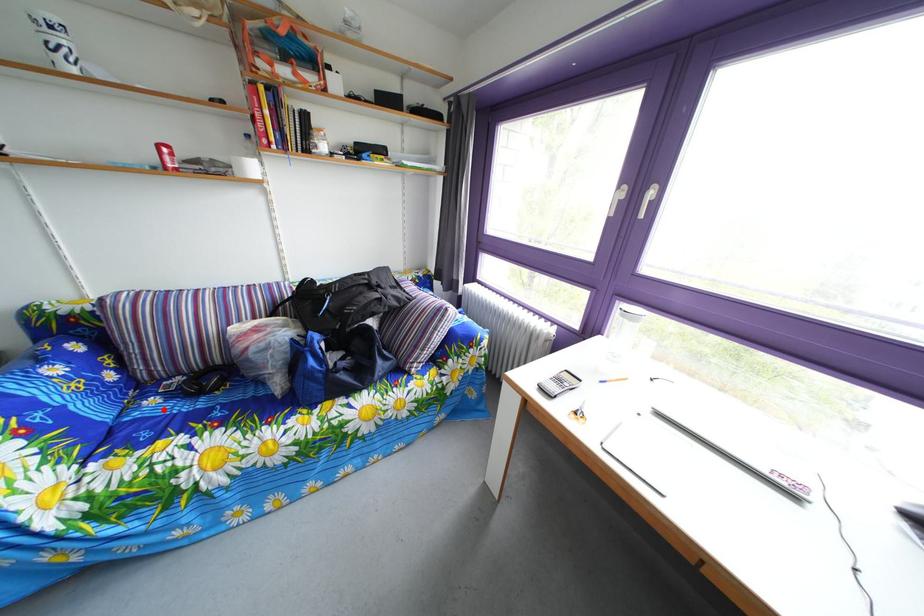
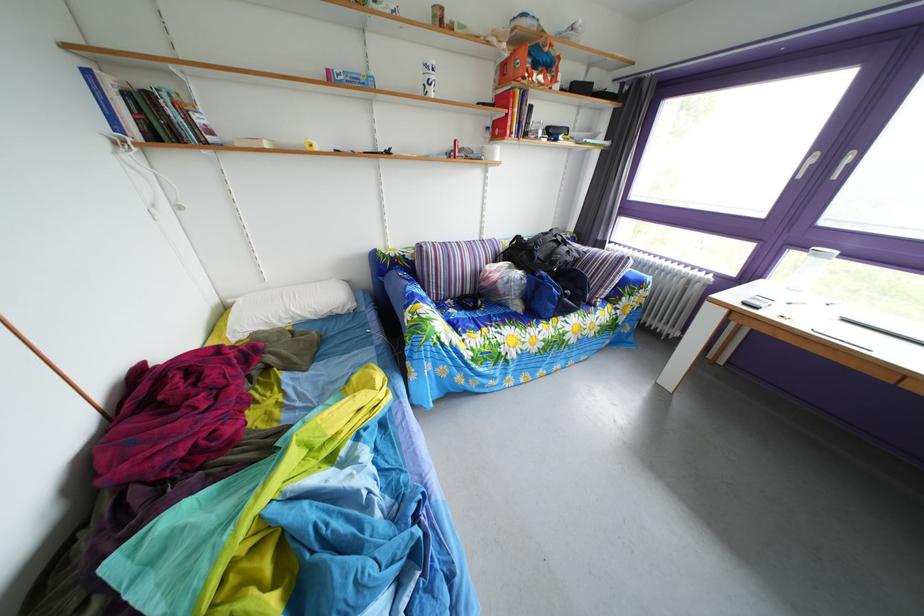
Locate, in the second image, the point that corresponds to the highlighted location in the first image.

(463, 320)